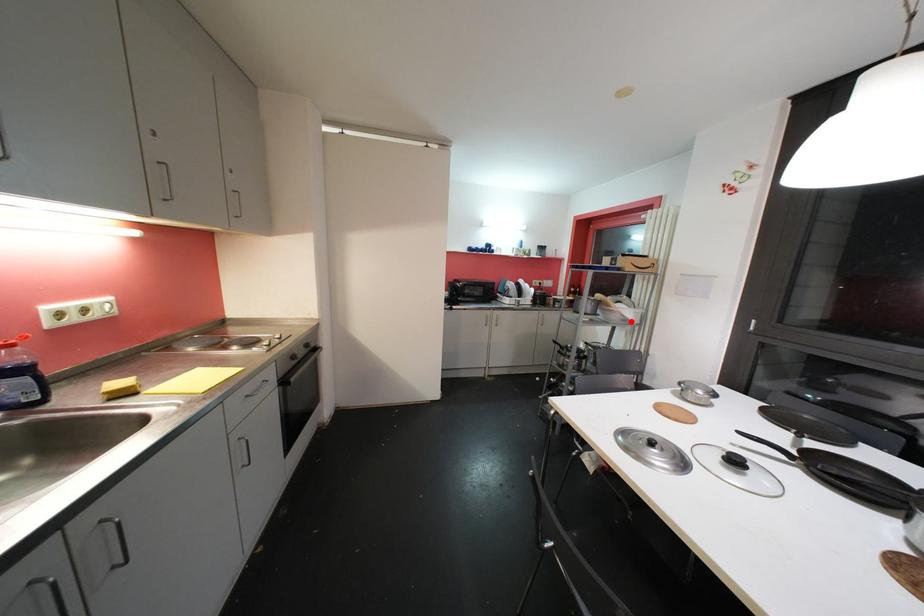
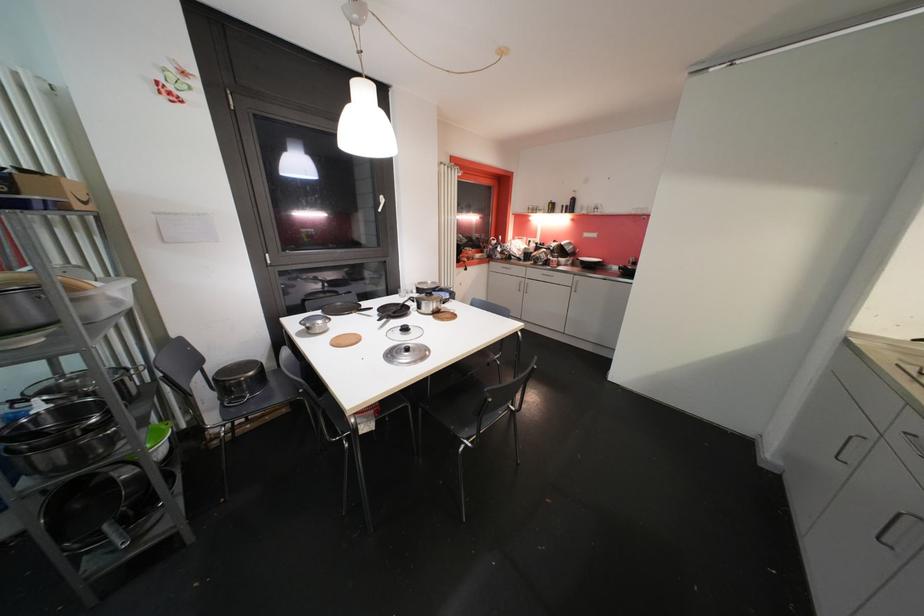
In the second image, find the point that corresponds to the highlighted location in the first image.

(122, 305)